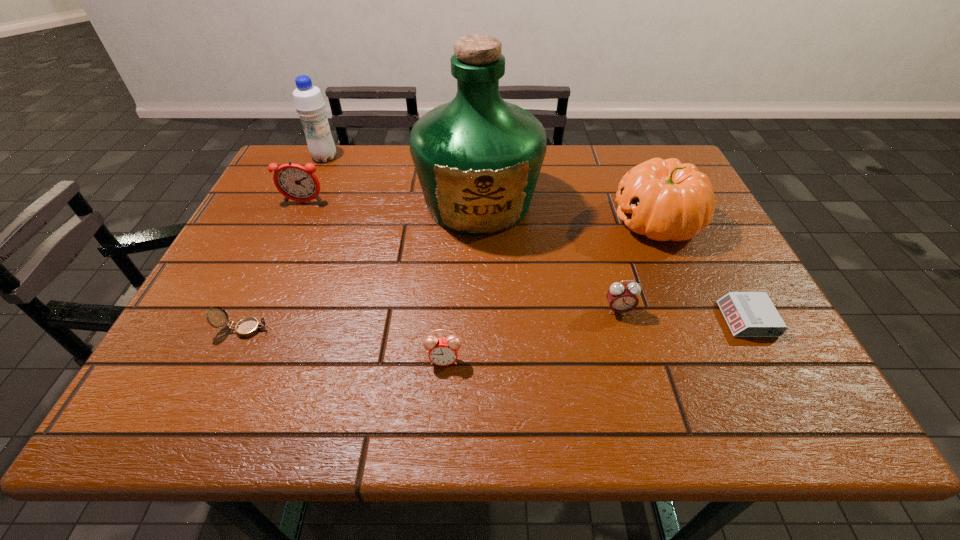
At what (x,y) coordinates should I click in order to perform the action: click on vacant space at the far edge. Please return your answer as a coordinate pair (x, y). Looking at the image, I should click on (607, 159).

In the image, there is a desktop. In order to click on vacant space at the near edge in this screenshot , I will do `click(434, 380)`.

In the image, there is a desktop. Identify the location of vacant area at the left edge. The height and width of the screenshot is (540, 960). (207, 322).

At what (x,y) coordinates should I click in order to perform the action: click on vacant space at the right edge of the desktop. Please return your answer as a coordinate pair (x, y). This screenshot has height=540, width=960. Looking at the image, I should click on (755, 345).

This screenshot has height=540, width=960. I want to click on vacant space at the far right corner of the desktop, so click(636, 147).

Where is `vacant space at the near right corner of the desktop`? The image size is (960, 540). vacant space at the near right corner of the desktop is located at coordinates (756, 386).

The width and height of the screenshot is (960, 540). Identify the location of free area in between the shortest object and the second alarm clock from left to right. (595, 340).

You are a GUI agent. You are given a task and a screenshot of the screen. Output one action in this format:
    pyautogui.click(x=<x>, y=<y>)
    Task: Click on the blank region between the liquor and the third alarm clock from right to left
    This screenshot has width=960, height=540.
    Given the screenshot: What is the action you would take?
    pyautogui.click(x=461, y=281)

Image resolution: width=960 pixels, height=540 pixels. Find the location of `blank region between the second alarm clock from left to right and the farthest object`. blank region between the second alarm clock from left to right and the farthest object is located at coordinates (384, 259).

This screenshot has height=540, width=960. I want to click on unoccupied area between the second alarm clock from right to left and the compass, so click(x=432, y=320).